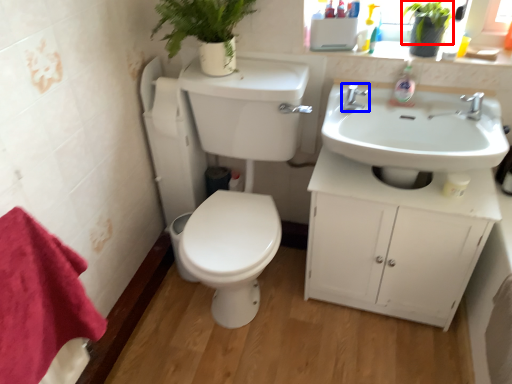
Question: Which of the following is the farthest to the observer, plant (highlighted by a red box) or tap (highlighted by a blue box)?

Choices:
 (A) plant
 (B) tap

Answer: (B)